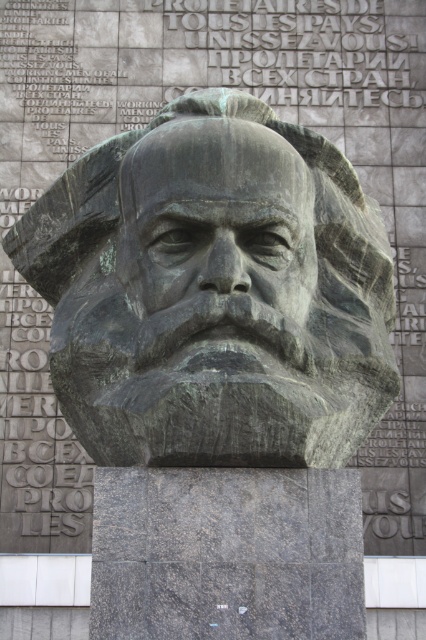
Question: Based on their relative distances, which object is nearer to the gray stone text at upper center?

Choices:
 (A) bronze statue at center
 (B) bronze statue head at center

Answer: (B)

Question: Is bronze statue at center to the right of gray stone text at upper center from the viewer's perspective?

Choices:
 (A) no
 (B) yes

Answer: (A)

Question: Is bronze statue at center positioned behind bronze statue head at center?

Choices:
 (A) yes
 (B) no

Answer: (A)

Question: Which object appears closest to the camera in this image?

Choices:
 (A) bronze statue head at center
 (B) bronze statue at center

Answer: (A)

Question: Is bronze statue at center bigger than bronze statue head at center?

Choices:
 (A) yes
 (B) no

Answer: (B)

Question: Which point is farther to the camera?

Choices:
 (A) bronze statue at center
 (B) gray stone text at upper center
 (C) bronze statue head at center

Answer: (B)